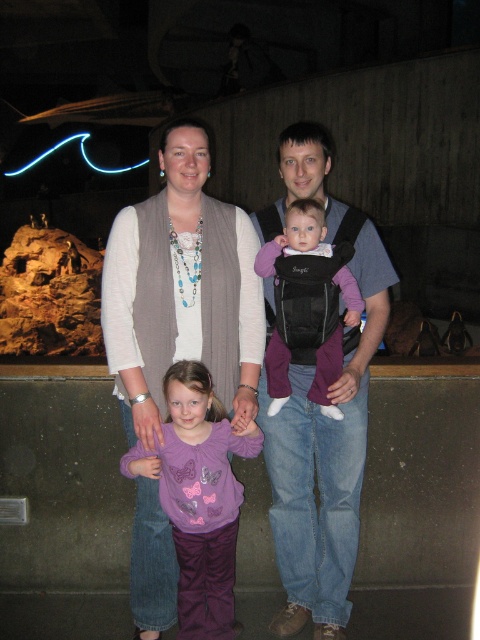
You are a photographer trying to capture a candid shot of the denim jeans at center and the purple satin shirt at lower center. Since the scene is dimly lit, you need to adjust your camera settings to focus on both subjects. Based on their positions, which clothing item is closer to the camera lens?

The denim jeans at center is located above the purple satin shirt at lower center, so the denim jeans at center is closer to the camera lens.

You are a photographer trying to capture a candid shot of the family. You notice the matte gray vest at center and denim jeans at center. Which one is positioned to the left side of the other?

The matte gray vest at center is to the left of denim jeans at center.